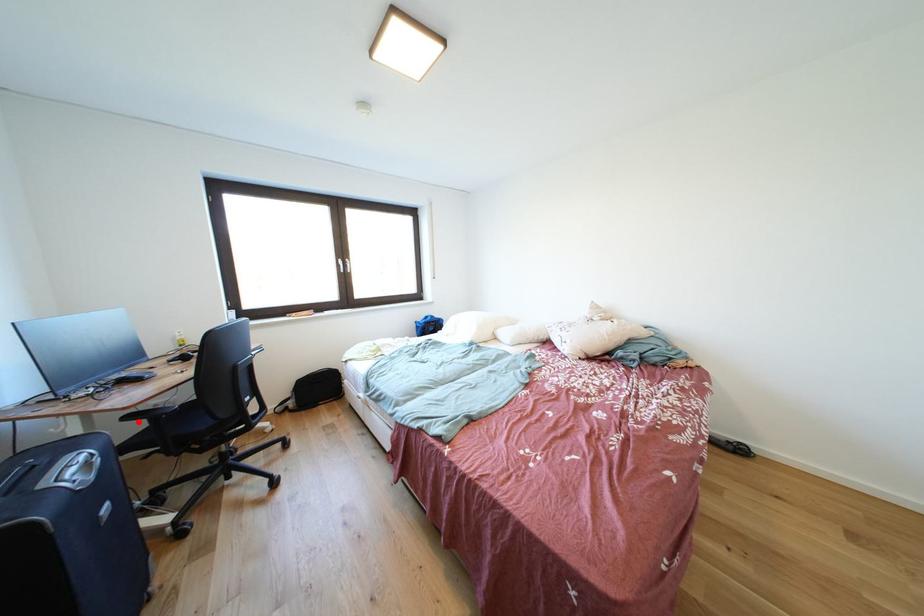
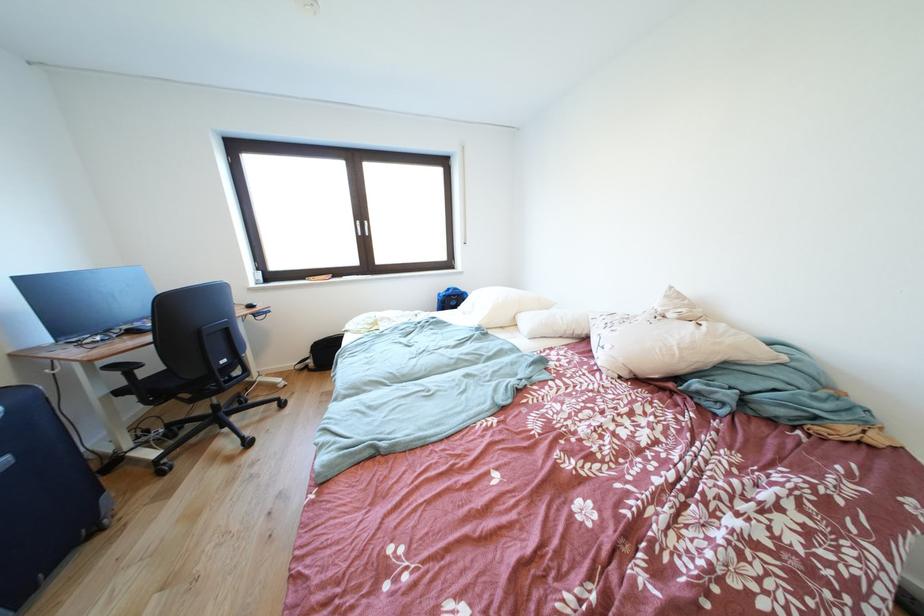
Locate, in the second image, the point that corresponds to the highlighted location in the first image.

(120, 371)